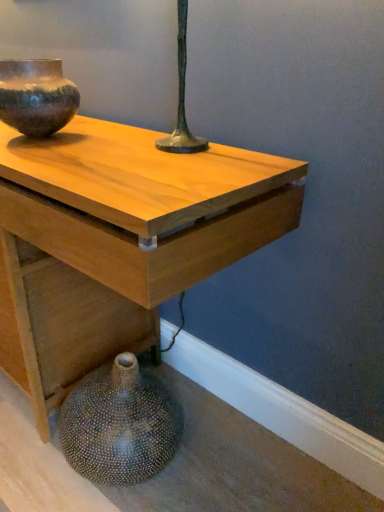
Question: From a real-world perspective, is rustic ceramic vase at upper left, marked as the second vase in a bottom-to-top arrangement, physically below light wood table at center?

Choices:
 (A) yes
 (B) no

Answer: (B)

Question: Is rustic ceramic vase at upper left, marked as the second vase in a bottom-to-top arrangement, located outside light wood table at center?

Choices:
 (A) no
 (B) yes

Answer: (B)

Question: Does rustic ceramic vase at upper left, positioned as the 1th vase in top-to-bottom order, have a lesser height compared to light wood table at center?

Choices:
 (A) yes
 (B) no

Answer: (A)

Question: From a real-world perspective, is rustic ceramic vase at upper left, positioned as the 1th vase in top-to-bottom order, physically above light wood table at center?

Choices:
 (A) no
 (B) yes

Answer: (B)

Question: Is rustic ceramic vase at upper left, marked as the second vase in a bottom-to-top arrangement, behind light wood table at center?

Choices:
 (A) yes
 (B) no

Answer: (A)

Question: From their relative heights in the image, would you say rustic ceramic vase at upper left, marked as the second vase in a bottom-to-top arrangement, is taller or shorter than light wood table at center?

Choices:
 (A) short
 (B) tall

Answer: (A)

Question: Is point (34, 94) positioned closer to the camera than point (96, 187)?

Choices:
 (A) farther
 (B) closer

Answer: (A)

Question: From the image's perspective, relative to light wood table at center, is rustic ceramic vase at upper left, marked as the second vase in a bottom-to-top arrangement, above or below?

Choices:
 (A) below
 (B) above

Answer: (B)

Question: Considering the positions of rustic ceramic vase at upper left, marked as the second vase in a bottom-to-top arrangement, and light wood table at center in the image, is rustic ceramic vase at upper left, marked as the second vase in a bottom-to-top arrangement, bigger or smaller than light wood table at center?

Choices:
 (A) big
 (B) small

Answer: (B)

Question: From the image's perspective, is rustic ceramic vase at upper left, marked as the second vase in a bottom-to-top arrangement, above or below speckled ceramic vase at lower left, the first vase when ordered from bottom to top?

Choices:
 (A) above
 (B) below

Answer: (A)

Question: Considering the positions of rustic ceramic vase at upper left, marked as the second vase in a bottom-to-top arrangement, and speckled ceramic vase at lower left, the first vase when ordered from bottom to top, in the image, is rustic ceramic vase at upper left, marked as the second vase in a bottom-to-top arrangement, taller or shorter than speckled ceramic vase at lower left, the first vase when ordered from bottom to top,?

Choices:
 (A) short
 (B) tall

Answer: (A)

Question: Considering the relative positions of rustic ceramic vase at upper left, marked as the second vase in a bottom-to-top arrangement, and speckled ceramic vase at lower left, the first vase when ordered from bottom to top, in the image provided, is rustic ceramic vase at upper left, marked as the second vase in a bottom-to-top arrangement, to the left or to the right of speckled ceramic vase at lower left, the first vase when ordered from bottom to top,?

Choices:
 (A) left
 (B) right

Answer: (A)

Question: Is rustic ceramic vase at upper left, positioned as the 1th vase in top-to-bottom order, bigger or smaller than speckled ceramic vase at lower left, which is the 2th vase from top to bottom?

Choices:
 (A) small
 (B) big

Answer: (A)

Question: Is speckled ceramic vase at lower left, the first vase when ordered from bottom to top, situated inside light wood table at center or outside?

Choices:
 (A) inside
 (B) outside

Answer: (A)

Question: From the image's perspective, is speckled ceramic vase at lower left, the first vase when ordered from bottom to top, located above or below light wood table at center?

Choices:
 (A) below
 (B) above

Answer: (A)